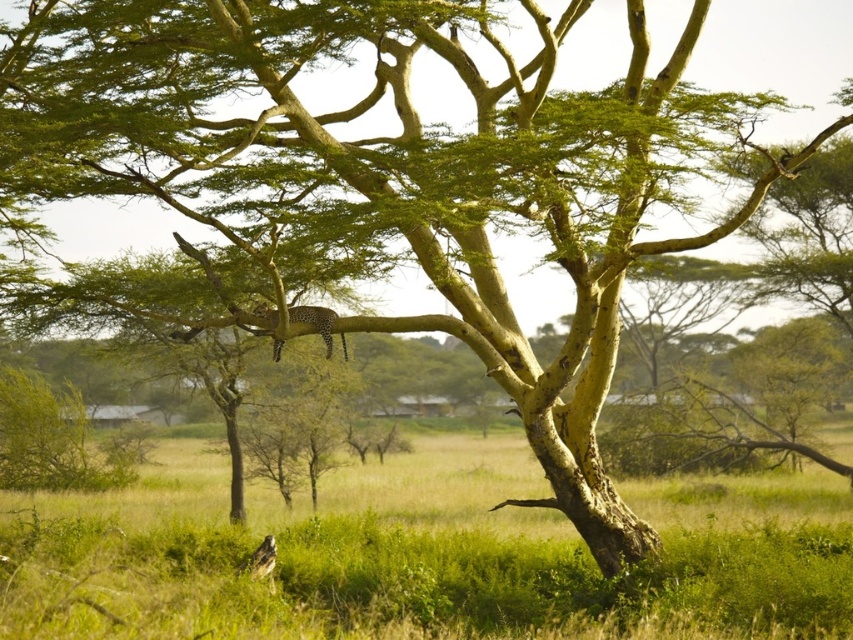
Consider the image. Is spotted fur cheetah at upper center above spotted fur leopard at lower left?

Indeed, spotted fur cheetah at upper center is positioned over spotted fur leopard at lower left.

Is point (260, 308) closer to viewer compared to point (263, 538)?

Yes.

Image resolution: width=853 pixels, height=640 pixels. In order to click on spotted fur cheetah at upper center in this screenshot , I will do `click(315, 321)`.